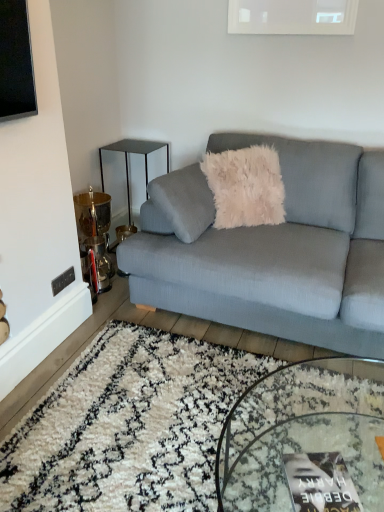
Question: Can you confirm if textured gray couch at center is smaller than clear glass coffee table at center?

Choices:
 (A) yes
 (B) no

Answer: (B)

Question: Is textured gray couch at center outside of clear glass coffee table at center?

Choices:
 (A) yes
 (B) no

Answer: (A)

Question: Is textured gray couch at center far from clear glass coffee table at center?

Choices:
 (A) yes
 (B) no

Answer: (B)

Question: Is textured gray couch at center positioned in front of clear glass coffee table at center?

Choices:
 (A) no
 (B) yes

Answer: (A)

Question: Can you confirm if textured gray couch at center is positioned to the left of clear glass coffee table at center?

Choices:
 (A) yes
 (B) no

Answer: (B)

Question: Considering the positions of point (147, 181) and point (274, 334), is point (147, 181) closer or farther from the camera than point (274, 334)?

Choices:
 (A) farther
 (B) closer

Answer: (A)

Question: Is metallic black side table at upper left taller or shorter than textured gray couch at center?

Choices:
 (A) short
 (B) tall

Answer: (A)

Question: From the image's perspective, is metallic black side table at upper left located above or below textured gray couch at center?

Choices:
 (A) above
 (B) below

Answer: (A)

Question: From a real-world perspective, is metallic black side table at upper left above or below textured gray couch at center?

Choices:
 (A) below
 (B) above

Answer: (A)

Question: Considering their positions, is textured gray couch at center located in front of or behind clear glass coffee table at center?

Choices:
 (A) front
 (B) behind

Answer: (B)

Question: In terms of size, does textured gray couch at center appear bigger or smaller than clear glass coffee table at center?

Choices:
 (A) big
 (B) small

Answer: (A)

Question: From the image's perspective, is textured gray couch at center above or below clear glass coffee table at center?

Choices:
 (A) below
 (B) above

Answer: (B)

Question: Is textured gray couch at center to the left or to the right of clear glass coffee table at center in the image?

Choices:
 (A) right
 (B) left

Answer: (A)

Question: In terms of height, does textured gray couch at center look taller or shorter compared to matte black magazine at lower center?

Choices:
 (A) short
 (B) tall

Answer: (B)

Question: Relative to matte black magazine at lower center, is textured gray couch at center in front or behind?

Choices:
 (A) behind
 (B) front

Answer: (A)